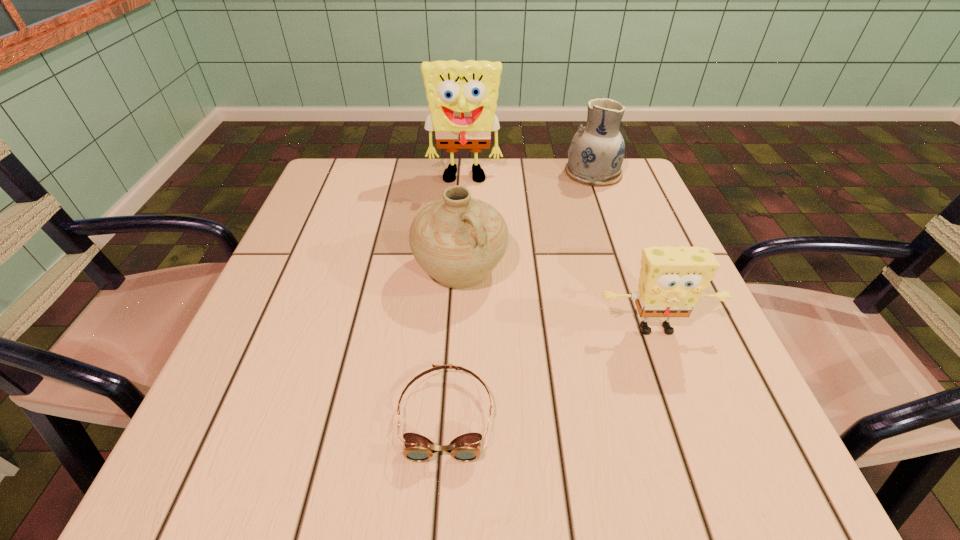
Where is `free space between the fourth farthest object and the nearer pottery`? free space between the fourth farthest object and the nearer pottery is located at coordinates (558, 299).

You are a GUI agent. You are given a task and a screenshot of the screen. Output one action in this format:
    pyautogui.click(x=<x>, y=<y>)
    Task: Click on the free space between the shorter sponge and the taller sponge
    Image resolution: width=960 pixels, height=540 pixels.
    Given the screenshot: What is the action you would take?
    pyautogui.click(x=560, y=253)

What are the coordinates of `the fourth closest object relative to the left pottery` in the screenshot? It's located at (595, 155).

This screenshot has height=540, width=960. In order to click on the second closest object to the third nearest object in this screenshot , I will do `click(465, 448)`.